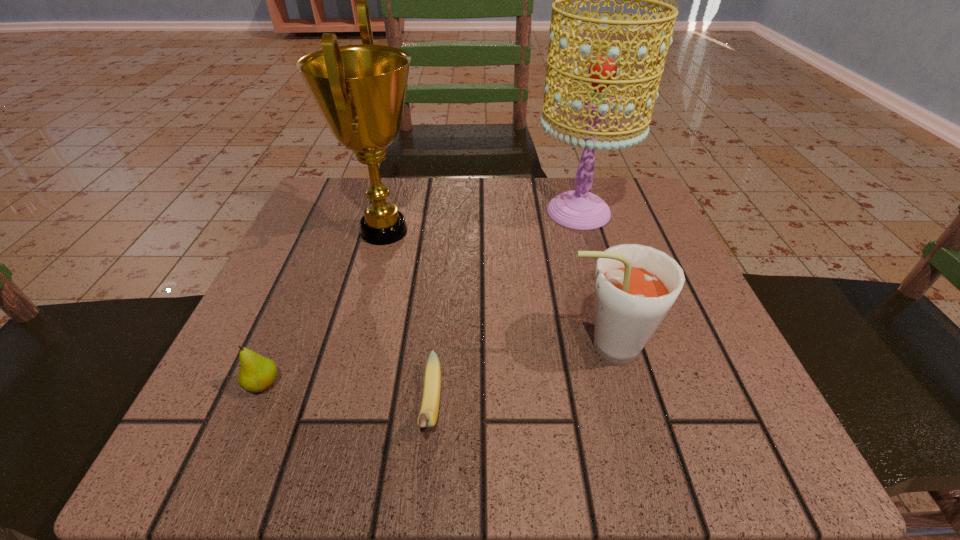
Where is `object present at the far left corner`? The width and height of the screenshot is (960, 540). object present at the far left corner is located at coordinates (360, 90).

Image resolution: width=960 pixels, height=540 pixels. Identify the location of object present at the far right corner. (579, 209).

Identify the location of vacant space at the far edge of the desktop. This screenshot has height=540, width=960. (527, 209).

Where is `vacant region at the near edge`? This screenshot has height=540, width=960. vacant region at the near edge is located at coordinates (547, 418).

At what (x,y) coordinates should I click in order to perform the action: click on vacant region at the left edge of the desktop. Please return your answer as a coordinate pair (x, y). The width and height of the screenshot is (960, 540). Looking at the image, I should click on (337, 266).

Where is `vacant area at the right edge of the desktop`? vacant area at the right edge of the desktop is located at coordinates (680, 325).

In order to click on free region at the far left corner in this screenshot , I will do `click(350, 181)`.

I want to click on vacant area at the far right corner, so click(x=616, y=201).

Where is `free area in between the lampshade and the third object from right to left`? The image size is (960, 540). free area in between the lampshade and the third object from right to left is located at coordinates (505, 309).

Find the location of a particular element. free spot between the banana and the lampshade is located at coordinates coord(505,309).